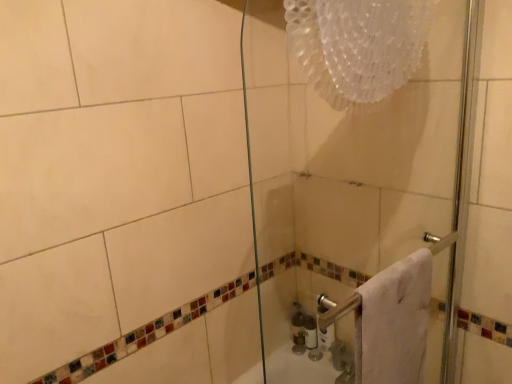
What do you see at coordinates (359, 192) in the screenshot? This screenshot has width=512, height=384. I see `transparent glass shower door at center` at bounding box center [359, 192].

Where is `white glossy toilet paper at lower right`? white glossy toilet paper at lower right is located at coordinates (326, 337).

Is white fluffy towel at right behind transparent glass shower door at center?

Yes, white fluffy towel at right is further from the viewer.

From the image's perspective, would you say white fluffy towel at right is positioned over transparent glass shower door at center?

No, from the image's perspective, white fluffy towel at right is not above transparent glass shower door at center.

Is white fluffy towel at right aimed at transparent glass shower door at center?

No, white fluffy towel at right is not turned towards transparent glass shower door at center.

Is transparent glass shower door at center turned away from white glossy bottle at lower center?

Yes, white glossy bottle at lower center is at the back of transparent glass shower door at center.

Is transparent glass shower door at center to the left of white glossy bottle at lower center from the viewer's perspective?

In fact, transparent glass shower door at center is to the right of white glossy bottle at lower center.

Considering the sizes of objects transparent glass shower door at center and white glossy bottle at lower center in the image provided, who is taller, transparent glass shower door at center or white glossy bottle at lower center?

With more height is transparent glass shower door at center.

Is white glossy bottle at lower center oriented away from white glossy toilet paper at lower right?

No, white glossy bottle at lower center is not facing the opposite direction of white glossy toilet paper at lower right.

Which object is thinner, white glossy bottle at lower center or white glossy toilet paper at lower right?

white glossy toilet paper at lower right.

From the image's perspective, is white glossy bottle at lower center located above or below white glossy toilet paper at lower right?

From the image's perspective, white glossy bottle at lower center appears below white glossy toilet paper at lower right.

From a real-world perspective, is white glossy bottle at lower center beneath white glossy toilet paper at lower right?

Yes, from a real-world perspective, white glossy bottle at lower center is beneath white glossy toilet paper at lower right.

From the image's perspective, is white glossy toilet paper at lower right located beneath transparent glass shower door at center?

Yes.

Is point (327, 335) closer to camera compared to point (366, 317)?

No, it is behind (366, 317).

Based on their sizes in the image, would you say white glossy toilet paper at lower right is bigger or smaller than transparent glass shower door at center?

white glossy toilet paper at lower right is smaller than transparent glass shower door at center.

From a real-world perspective, is white glossy toilet paper at lower right beneath transparent glass shower door at center?

Yes, from a real-world perspective, white glossy toilet paper at lower right is under transparent glass shower door at center.

Is transparent glass shower door at center not close to white glossy toilet paper at lower right?

transparent glass shower door at center is near white glossy toilet paper at lower right, not far away.

Can you tell me how much transparent glass shower door at center and white glossy toilet paper at lower right differ in facing direction?

The angle between the facing direction of transparent glass shower door at center and the facing direction of white glossy toilet paper at lower right is 89.5 degrees.

Based on the photo, which of these two, transparent glass shower door at center or white glossy toilet paper at lower right, stands taller?

With more height is transparent glass shower door at center.

Consider the image. From the image's perspective, which one is positioned higher, transparent glass shower door at center or white glossy toilet paper at lower right?

transparent glass shower door at center is shown above in the image.

Which is behind, point (310, 101) or point (399, 271)?

The point (310, 101) is more distant.

Between transparent glass shower door at center and white fluffy towel at right, which one appears on the left side from the viewer's perspective?

transparent glass shower door at center.

Looking at the image, does transparent glass shower door at center seem bigger or smaller compared to white fluffy towel at right?

In the image, transparent glass shower door at center appears to be larger than white fluffy towel at right.

Which of these two, transparent glass shower door at center or white fluffy towel at right, stands taller?

transparent glass shower door at center is taller.

Looking at their sizes, would you say white glossy toilet paper at lower right is wider or thinner than white fluffy towel at right?

Considering their sizes, white glossy toilet paper at lower right looks slimmer than white fluffy towel at right.

From a real-world perspective, which is physically below, white glossy toilet paper at lower right or white fluffy towel at right?

white glossy toilet paper at lower right.

From the image's perspective, does white glossy toilet paper at lower right appear higher than white fluffy towel at right?

No, from the image's perspective, white glossy toilet paper at lower right is not over white fluffy towel at right.

Looking at this image, between white glossy toilet paper at lower right and white fluffy towel at right, which one appears on the left side from the viewer's perspective?

Positioned to the left is white glossy toilet paper at lower right.

The image size is (512, 384). Identify the location of shower door in front of the white fluffy towel at right. (359, 192).

Locate an element on the screen. The image size is (512, 384). toiletry that appears below the transparent glass shower door at center (from the image's perspective) is located at coordinates (310, 332).

Looking at this image, based on their spatial positions, is transparent glass shower door at center or white fluffy towel at right further from white glossy bottle at lower center?

Among the two, white fluffy towel at right is located further to white glossy bottle at lower center.

Based on their spatial positions, is white fluffy towel at right or white glossy bottle at lower center closer to transparent glass shower door at center?

Among the two, white fluffy towel at right is located nearer to transparent glass shower door at center.

Based on their spatial positions, is white glossy toilet paper at lower right or white fluffy towel at right further from white glossy bottle at lower center?

Among the two, white fluffy towel at right is located further to white glossy bottle at lower center.

Estimate the real-world distances between objects in this image. Which object is closer to white glossy toilet paper at lower right, white glossy bottle at lower center or white fluffy towel at right?

white glossy bottle at lower center is closer to white glossy toilet paper at lower right.

Based on the photo, considering their positions, is white fluffy towel at right positioned closer to white glossy bottle at lower center than transparent glass shower door at center?

Based on the image, transparent glass shower door at center appears to be nearer to white glossy bottle at lower center.

Based on the photo, based on their spatial positions, is white glossy toilet paper at lower right or white fluffy towel at right closer to transparent glass shower door at center?

Among the two, white fluffy towel at right is located nearer to transparent glass shower door at center.

Considering their positions, is white glossy toilet paper at lower right positioned closer to white glossy bottle at lower center than transparent glass shower door at center?

white glossy toilet paper at lower right lies closer to white glossy bottle at lower center than the other object.

From the image, which object appears to be nearer to transparent glass shower door at center, white glossy bottle at lower center or white fluffy towel at right?

Based on the image, white fluffy towel at right appears to be nearer to transparent glass shower door at center.

Where is `towel located between transparent glass shower door at center and white glossy toilet paper at lower right in the depth direction`? This screenshot has height=384, width=512. towel located between transparent glass shower door at center and white glossy toilet paper at lower right in the depth direction is located at coordinates (396, 320).

I want to click on towel between transparent glass shower door at center and white glossy bottle at lower center along the z-axis, so click(x=396, y=320).

You are a GUI agent. You are given a task and a screenshot of the screen. Output one action in this format:
    pyautogui.click(x=<x>, y=<y>)
    Task: Click on the toilet paper positioned between transparent glass shower door at center and white glossy bottle at lower center from near to far
    This screenshot has height=384, width=512.
    Given the screenshot: What is the action you would take?
    pyautogui.click(x=326, y=337)

Locate an element on the screen. This screenshot has height=384, width=512. toilet paper positioned between white fluffy towel at right and white glossy bottle at lower center from near to far is located at coordinates (326, 337).